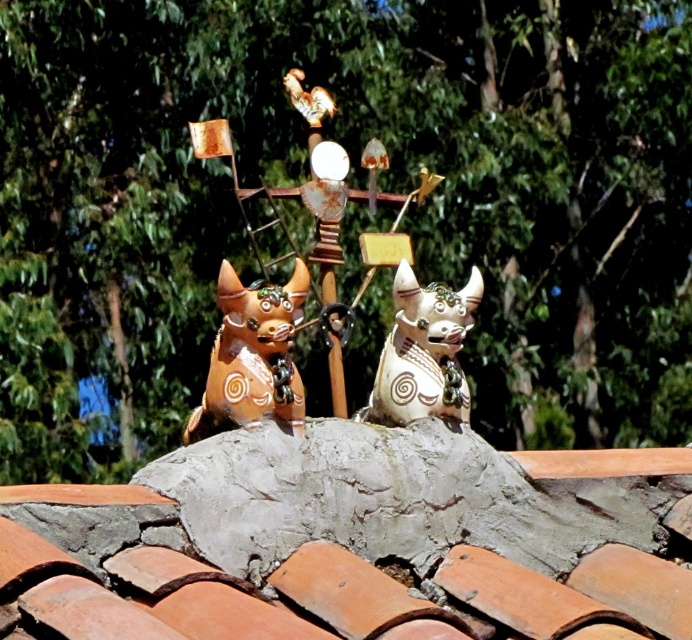
Question: Can you confirm if terracotta tiles at center is thinner than matte ceramic dogs at center?

Choices:
 (A) no
 (B) yes

Answer: (A)

Question: Observing the image, what is the correct spatial positioning of matte ceramic dogs at center in reference to matte ceramic dog at center?

Choices:
 (A) left
 (B) right

Answer: (A)

Question: Which of these objects is positioned closest to the matte orange statue at center?

Choices:
 (A) terracotta tiles at center
 (B) matte ceramic dogs at center

Answer: (B)

Question: Which of the following is the farthest from the observer?

Choices:
 (A) (236, 296)
 (B) (430, 180)
 (C) (104, 596)
 (D) (450, 374)

Answer: (B)

Question: Does matte orange statue at center have a smaller size compared to matte ceramic dog at center?

Choices:
 (A) no
 (B) yes

Answer: (A)

Question: Estimate the real-world distances between objects in this image. Which object is farther from the matte ceramic dog at center?

Choices:
 (A) matte orange statue at center
 (B) matte ceramic dogs at center

Answer: (A)